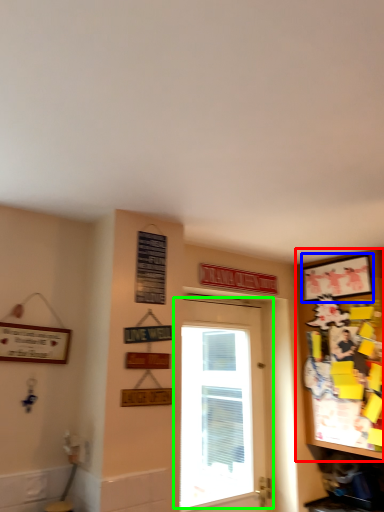
Question: Based on their relative distances, which object is nearer to cabinetry (highlighted by a red box)? Choose from picture frame (highlighted by a blue box) and door (highlighted by a green box).

Choices:
 (A) picture frame
 (B) door

Answer: (A)